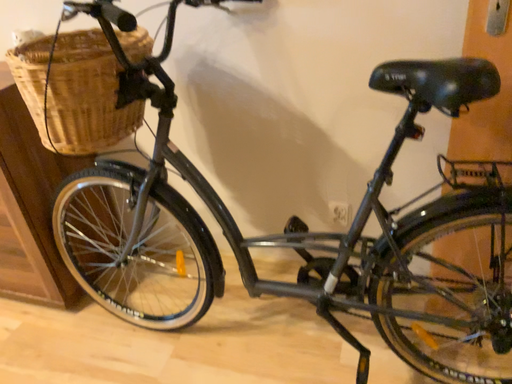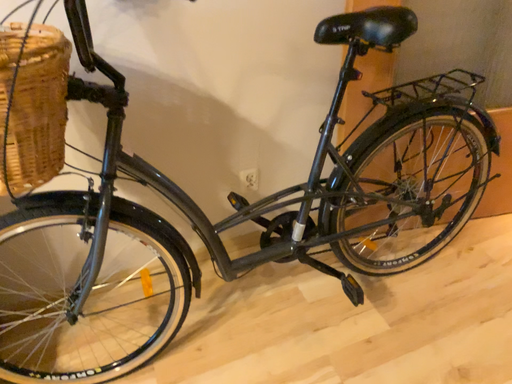
Question: Which way did the camera rotate in the video?

Choices:
 (A) rotated left
 (B) rotated right

Answer: (B)